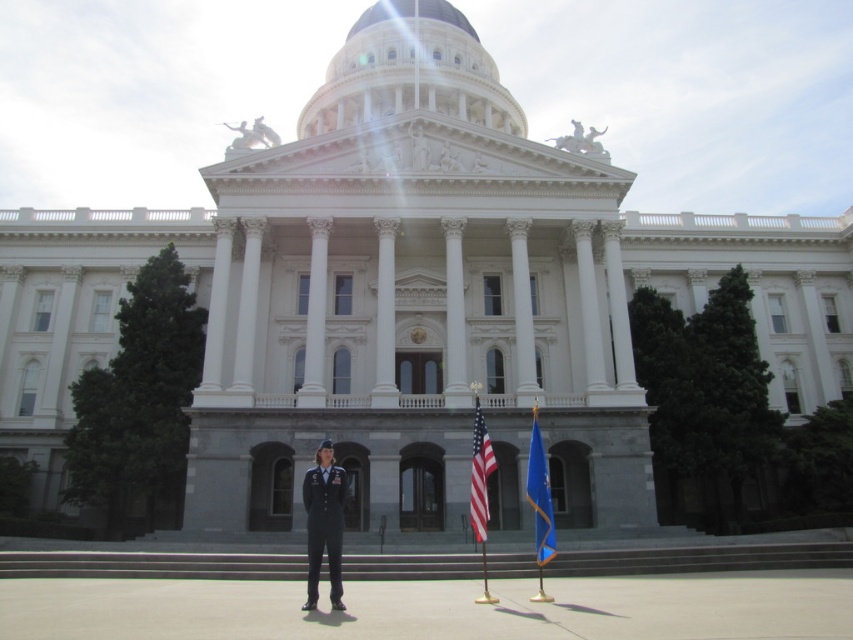
Question: Which of the following is the closest to the observer?

Choices:
 (A) (544, 472)
 (B) (334, 568)

Answer: (B)

Question: Among these objects, which one is nearest to the camera?

Choices:
 (A) american flag at center
 (B) blue fabric flag at center

Answer: (A)

Question: Can you confirm if dark blue uniform at center is wider than blue fabric flag at center?

Choices:
 (A) yes
 (B) no

Answer: (A)

Question: Observing the image, what is the correct spatial positioning of dark blue uniform at center in reference to american flag at center?

Choices:
 (A) right
 (B) left

Answer: (B)

Question: Is dark blue uniform at center further to camera compared to blue fabric flag at center?

Choices:
 (A) no
 (B) yes

Answer: (A)

Question: Based on their relative distances, which object is nearer to the blue fabric flag at center?

Choices:
 (A) american flag at center
 (B) dark blue uniform at center

Answer: (A)